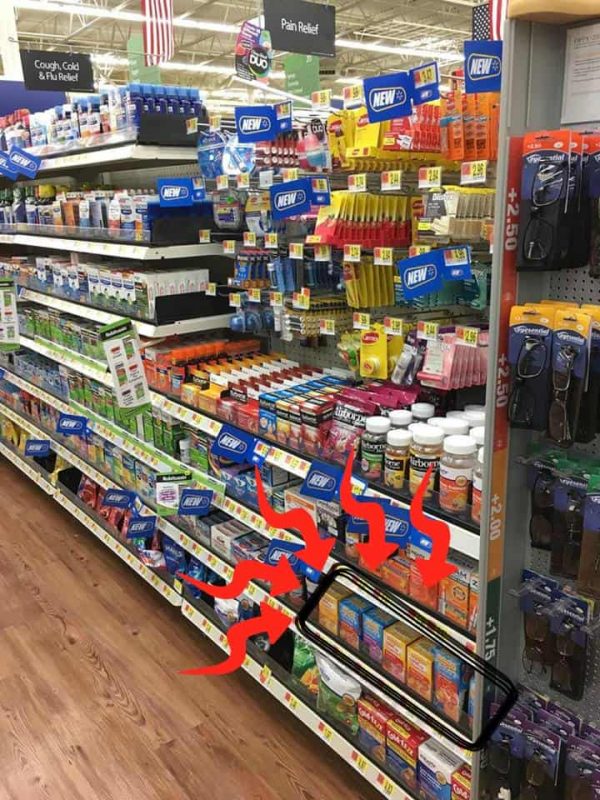
This screenshot has height=800, width=600. What are the coordinates of `store shelves` in the screenshot? It's located at (126, 152), (145, 252), (153, 330), (167, 406), (145, 450), (170, 529), (151, 576).